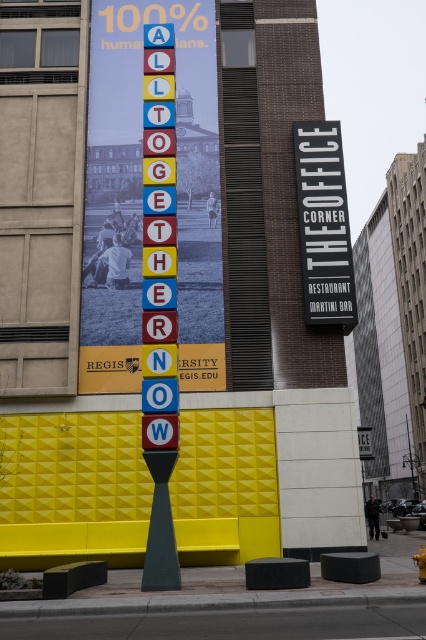
Question: Among these points, which one is nearest to the camera?

Choices:
 (A) (299, 216)
 (B) (187, 124)

Answer: (A)

Question: Is metallic signboard at center further to the viewer compared to black plastic sign at upper right?

Choices:
 (A) no
 (B) yes

Answer: (A)

Question: Which point is farther from the camera taking this photo?

Choices:
 (A) (321, 202)
 (B) (178, 84)

Answer: (B)

Question: Which point appears closest to the camera in this image?

Choices:
 (A) (89, 228)
 (B) (331, 224)

Answer: (B)

Question: Can you confirm if metallic signboard at center is bigger than black plastic sign at upper right?

Choices:
 (A) no
 (B) yes

Answer: (B)

Question: Can you confirm if metallic signboard at center is positioned to the right of black plastic sign at upper right?

Choices:
 (A) yes
 (B) no

Answer: (B)